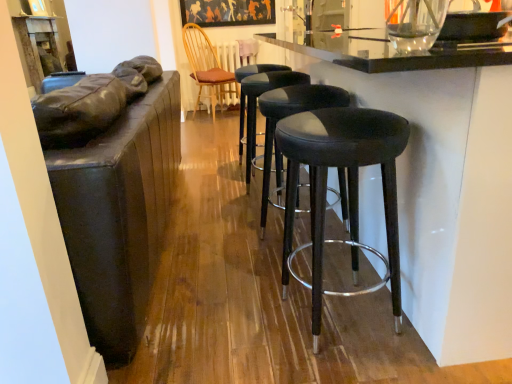
This screenshot has width=512, height=384. Identify the location of black leather stool at center, the second stool positioned from the front. (287, 116).

At what (x,y) coordinates should I click in order to perform the action: click on matte black frame at upper center. Please return your answer as a coordinate pair (x, y). Looking at the image, I should click on (227, 12).

Which is behind, black leather stool at center, the first stool when ordered from back to front, or matte black frame at upper center?

matte black frame at upper center is further away from the camera.

How much distance is there between black leather stool at center, marked as the third stool in a front-to-back arrangement, and matte black frame at upper center?

They are 7.44 feet apart.

From the image's perspective, is black leather stool at center, the first stool when ordered from back to front, above or below matte black frame at upper center?

From the image's perspective, black leather stool at center, the first stool when ordered from back to front, appears below matte black frame at upper center.

Is black leather stool at center, the first stool when ordered from back to front, wider than matte black frame at upper center?

Yes, black leather stool at center, the first stool when ordered from back to front, is wider than matte black frame at upper center.

How different are the orientations of matte black table at upper left and black leather stool at center, the first stool when ordered from back to front, in degrees?

The angle between the facing direction of matte black table at upper left and the facing direction of black leather stool at center, the first stool when ordered from back to front, is 1.87 degrees.

Does matte black table at upper left touch black leather stool at center, marked as the third stool in a front-to-back arrangement?

matte black table at upper left and black leather stool at center, marked as the third stool in a front-to-back arrangement, are not in contact.

Is matte black table at upper left to the left of black leather stool at center, the first stool when ordered from back to front, from the viewer's perspective?

Yes.

Is matte black table at upper left turned away from black leather stool at center, the first stool when ordered from back to front?

matte black table at upper left does not have its back to black leather stool at center, the first stool when ordered from back to front.

Is point (312, 282) positioned in front of point (271, 125)?

Yes, point (312, 282) is closer to viewer.

Considering the relative sizes of matte black stool at center, the 1th stool viewed from the front, and black leather stool at center, the second stool positioned from the front, in the image provided, is matte black stool at center, the 1th stool viewed from the front, shorter than black leather stool at center, the second stool positioned from the front,?

Incorrect, the height of matte black stool at center, the 1th stool viewed from the front, does not fall short of that of black leather stool at center, the second stool positioned from the front.

Looking at this image, is matte black stool at center, acting as the third stool starting from the back, at the left side of black leather stool at center, the second stool positioned from the front?

Incorrect, matte black stool at center, acting as the third stool starting from the back, is not on the left side of black leather stool at center, the second stool positioned from the front.

Where is `table above the matte black frame at upper center (from the image's perspective)`? table above the matte black frame at upper center (from the image's perspective) is located at coordinates (38, 47).

Is matte black frame at upper center in front of or behind matte black table at upper left in the image?

In the image, matte black frame at upper center appears in front of matte black table at upper left.

Considering the positions of objects matte black frame at upper center and matte black table at upper left in the image provided, who is more to the right, matte black frame at upper center or matte black table at upper left?

matte black frame at upper center is more to the right.

Considering the sizes of objects matte black frame at upper center and matte black table at upper left in the image provided, who is taller, matte black frame at upper center or matte black table at upper left?

With more height is matte black table at upper left.

Is the depth of matte black table at upper left less than that of black leather stool at center, the second stool positioned from the front?

That is False.

Is matte black table at upper left touching black leather stool at center, the second stool positioned from the front?

There is a gap between matte black table at upper left and black leather stool at center, the second stool positioned from the front.

Locate an element on the screen. Image resolution: width=512 pixels, height=384 pixels. the 2nd stool in front of the matte black table at upper left is located at coordinates (287, 116).

From a real-world perspective, relative to black leather stool at center, the second stool positioned from the front, is matte black table at upper left vertically above or below?

Clearly, from a real-world perspective, matte black table at upper left is above black leather stool at center, the second stool positioned from the front.

You are a GUI agent. You are given a task and a screenshot of the screen. Output one action in this format:
    pyautogui.click(x=<x>, y=<y>)
    Task: Click on the stool that is the 2nd one when counting downward from the black leather bar stools at center (from the image's perspective)
    This screenshot has width=512, height=384.
    Given the screenshot: What is the action you would take?
    pyautogui.click(x=287, y=116)

Which object is wider, black leather bar stools at center or black leather stool at center, the second stool positioned from the front?

black leather bar stools at center is wider.

From the image's perspective, is black leather bar stools at center above black leather stool at center, the second stool positioned from the front?

Yes, from the image's perspective, black leather bar stools at center is above black leather stool at center, the second stool positioned from the front.

Looking at this image, does black leather bar stools at center turn towards black leather stool at center, which is the second stool from back to front?

Yes, black leather bar stools at center faces towards black leather stool at center, which is the second stool from back to front.

Considering the sizes of objects black leather stool at center, marked as the third stool in a front-to-back arrangement, and wooden chair with cushion at center in the image provided, who is smaller, black leather stool at center, marked as the third stool in a front-to-back arrangement, or wooden chair with cushion at center?

With smaller size is black leather stool at center, marked as the third stool in a front-to-back arrangement.

From a real-world perspective, which is physically above, black leather stool at center, marked as the third stool in a front-to-back arrangement, or wooden chair with cushion at center?

From a 3D spatial view, wooden chair with cushion at center is above.

Does black leather stool at center, the first stool when ordered from back to front, come in front of wooden chair with cushion at center?

Yes, black leather stool at center, the first stool when ordered from back to front, is in front of wooden chair with cushion at center.

You are a GUI agent. You are given a task and a screenshot of the screen. Output one action in this format:
    pyautogui.click(x=<x>, y=<y>)
    Task: Click on the 1st stool to the right of the matte black frame at upper center, counting from the anchor's position
    Image resolution: width=512 pixels, height=384 pixels.
    Given the screenshot: What is the action you would take?
    pyautogui.click(x=256, y=104)

Identify the location of stool that is the 1st one when counting forward from the matte black table at upper left. The image size is (512, 384). (256, 104).

Which object lies further to the anchor point wooden chair with cushion at center, black leather stool at center, marked as the third stool in a front-to-back arrangement, or black leather bar stools at center?

black leather bar stools at center is positioned further to the anchor wooden chair with cushion at center.

From the image, which object appears to be nearer to black leather bar stools at center, matte black stool at center, acting as the third stool starting from the back, or black leather stool at center, the second stool positioned from the front?

matte black stool at center, acting as the third stool starting from the back, is closer to black leather bar stools at center.

Considering their positions, is matte black table at upper left positioned further to matte black frame at upper center than black leather stool at center, which is the second stool from back to front?

black leather stool at center, which is the second stool from back to front, is positioned further to the anchor matte black frame at upper center.

Looking at the image, which one is located further to matte black table at upper left, matte black stool at center, the 1th stool viewed from the front, or wooden chair with cushion at center?

Based on the image, wooden chair with cushion at center appears to be further to matte black table at upper left.

Which object lies nearer to the anchor point matte black stool at center, the 1th stool viewed from the front, black leather stool at center, the first stool when ordered from back to front, or wooden chair with cushion at center?

Among the two, black leather stool at center, the first stool when ordered from back to front, is located nearer to matte black stool at center, the 1th stool viewed from the front.

Looking at the image, which one is located further to matte black frame at upper center, black leather bar stools at center or black leather stool at center, marked as the third stool in a front-to-back arrangement?

The object further to matte black frame at upper center is black leather bar stools at center.

From the image, which object appears to be farther from wooden chair with cushion at center, black leather stool at center, the first stool when ordered from back to front, or black leather stool at center, the second stool positioned from the front?

black leather stool at center, the second stool positioned from the front, is positioned further to the anchor wooden chair with cushion at center.

Which object lies nearer to the anchor point black leather stool at center, the second stool positioned from the front, black leather stool at center, the first stool when ordered from back to front, or matte black stool at center, the 1th stool viewed from the front?

matte black stool at center, the 1th stool viewed from the front, is closer to black leather stool at center, the second stool positioned from the front.

Where is `stool located between black leather stool at center, which is the second stool from back to front, and wooden chair with cushion at center in the depth direction`? stool located between black leather stool at center, which is the second stool from back to front, and wooden chair with cushion at center in the depth direction is located at coordinates (256, 104).

Find the location of `picture frame positioned between black leather stool at center, the first stool when ordered from back to front, and matte black table at upper left from near to far`. picture frame positioned between black leather stool at center, the first stool when ordered from back to front, and matte black table at upper left from near to far is located at coordinates (227, 12).

Where is `stool positioned between black leather stool at center, the second stool positioned from the front, and matte black table at upper left from near to far`? stool positioned between black leather stool at center, the second stool positioned from the front, and matte black table at upper left from near to far is located at coordinates (256, 104).

Where is `stool located between black leather bar stools at center and black leather stool at center, the second stool positioned from the front, in the depth direction`? This screenshot has width=512, height=384. stool located between black leather bar stools at center and black leather stool at center, the second stool positioned from the front, in the depth direction is located at coordinates (348, 186).